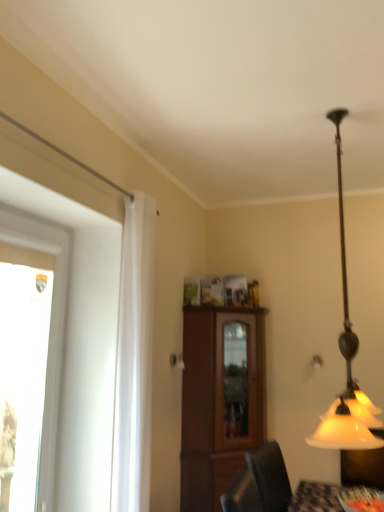
Question: From a real-world perspective, is brown wood cabinet at center above or below white sheer curtain at left?

Choices:
 (A) below
 (B) above

Answer: (A)

Question: Does point (221, 349) appear closer or farther from the camera than point (127, 477)?

Choices:
 (A) closer
 (B) farther

Answer: (B)

Question: Which object is the closest to the transparent glass window at left?

Choices:
 (A) white sheer curtain at left
 (B) matte glass lampshade at right
 (C) brown wood cabinet at center

Answer: (A)

Question: Based on their relative distances, which object is nearer to the matte glass lampshade at right?

Choices:
 (A) transparent glass window at left
 (B) brown wood cabinet at center
 (C) white sheer curtain at left

Answer: (C)